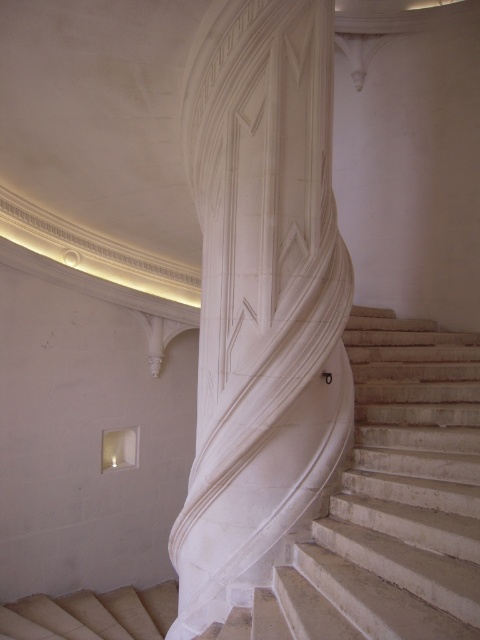
Is white marble pillar at center taller than white marble stairs at center?

Yes, white marble pillar at center is taller than white marble stairs at center.

Who is positioned more to the left, white marble pillar at center or white marble stairs at center?

white marble pillar at center is more to the left.

The image size is (480, 640). I want to click on white marble pillar at center, so click(x=262, y=300).

The image size is (480, 640). Identify the location of white marble pillar at center. (262, 300).

Can you confirm if white marble pillar at center is bigger than beige textured stairs at lower left?

Yes.

Can you confirm if white marble pillar at center is smaller than beige textured stairs at lower left?

Incorrect, white marble pillar at center is not smaller in size than beige textured stairs at lower left.

Who is more distant from viewer, (236, 436) or (81, 628)?

Positioned behind is point (81, 628).

Locate an element on the screen. white marble pillar at center is located at coordinates (262, 300).

Does white marble stairs at center appear under beige textured stairs at lower left?

No, white marble stairs at center is not below beige textured stairs at lower left.

Can you confirm if white marble stairs at center is wider than beige textured stairs at lower left?

Yes.

Locate an element on the screen. white marble stairs at center is located at coordinates (391, 500).